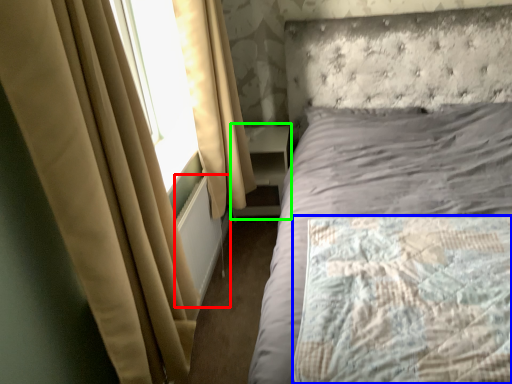
Question: Which object is the farthest from radiator (highlighted by a red box)? Choose among these: mattress (highlighted by a blue box) or bookshelf (highlighted by a green box).

Choices:
 (A) mattress
 (B) bookshelf

Answer: (A)